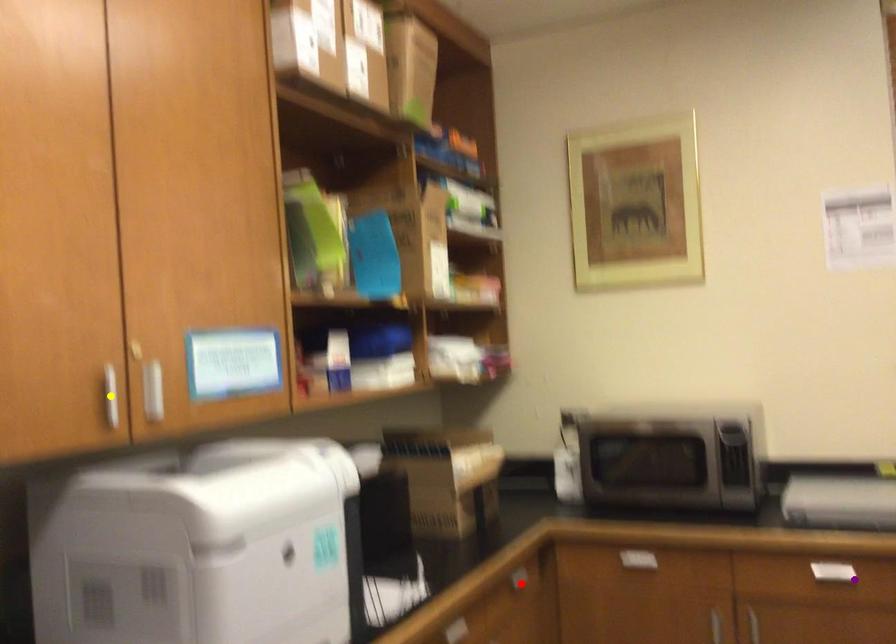
Order these from nearest to farthest:
A) yellow point
B) red point
C) purple point

1. yellow point
2. purple point
3. red point